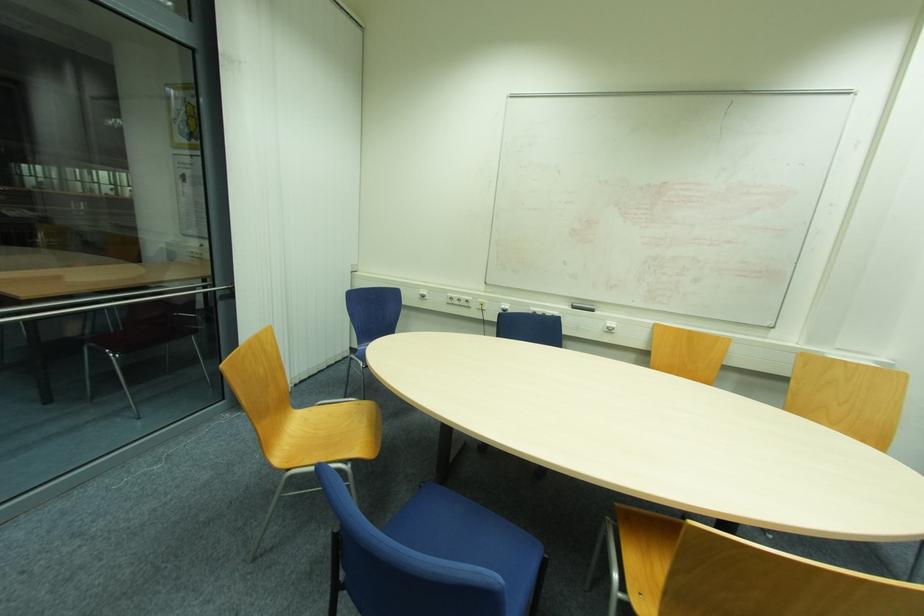
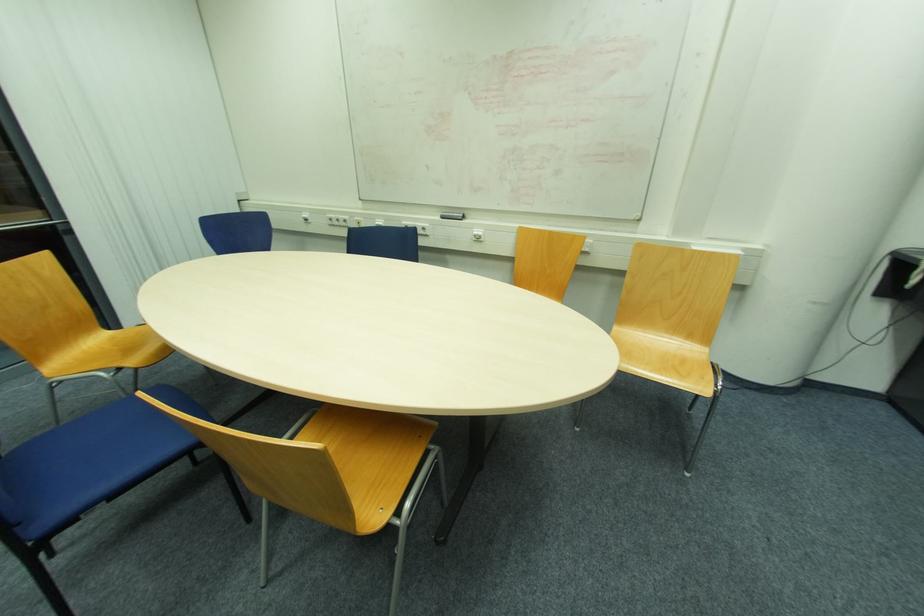
Question: The images are taken continuously from a first-person perspective. In which direction are you moving?

Choices:
 (A) Left
 (B) Right
 (C) Forward
 (D) Backward

Answer: (B)